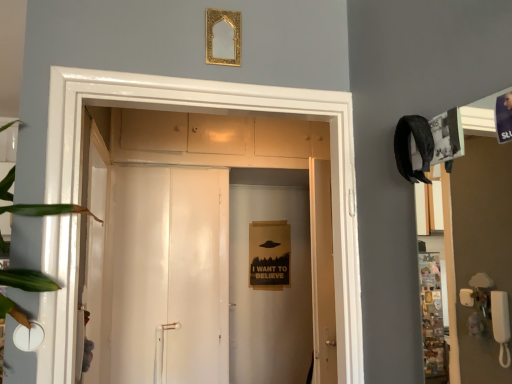
Question: From a real-world perspective, is green leafy plant at left over gold ornate mirror at upper center?

Choices:
 (A) yes
 (B) no

Answer: (B)

Question: Is green leafy plant at left located outside gold ornate mirror at upper center?

Choices:
 (A) no
 (B) yes

Answer: (B)

Question: Can you confirm if green leafy plant at left is smaller than gold ornate mirror at upper center?

Choices:
 (A) no
 (B) yes

Answer: (A)

Question: Is green leafy plant at left placed right next to gold ornate mirror at upper center?

Choices:
 (A) no
 (B) yes

Answer: (A)

Question: Is green leafy plant at left at the left side of gold ornate mirror at upper center?

Choices:
 (A) no
 (B) yes

Answer: (B)

Question: Does green leafy plant at left have a lesser width compared to gold ornate mirror at upper center?

Choices:
 (A) yes
 (B) no

Answer: (B)

Question: Does gold ornate mirror at upper center lie behind green leafy plant at left?

Choices:
 (A) no
 (B) yes

Answer: (B)

Question: Is gold ornate mirror at upper center bigger than green leafy plant at left?

Choices:
 (A) no
 (B) yes

Answer: (A)

Question: From a real-world perspective, is gold ornate mirror at upper center located beneath green leafy plant at left?

Choices:
 (A) yes
 (B) no

Answer: (B)

Question: Is gold ornate mirror at upper center shorter than green leafy plant at left?

Choices:
 (A) yes
 (B) no

Answer: (A)

Question: Can green leafy plant at left be found inside gold ornate mirror at upper center?

Choices:
 (A) yes
 (B) no

Answer: (B)

Question: Does gold ornate mirror at upper center have a lesser width compared to green leafy plant at left?

Choices:
 (A) yes
 (B) no

Answer: (A)

Question: Is white glossy door at center not within green leafy plant at left?

Choices:
 (A) no
 (B) yes

Answer: (B)